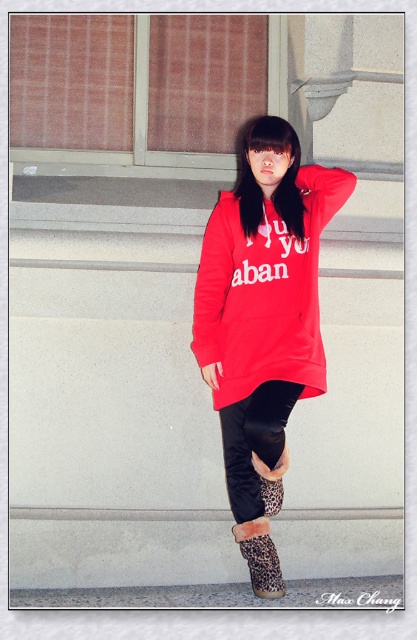
Who is positioned more to the left, matte red sweatshirt at center or leopard print fur boots at lower center?

Positioned to the left is leopard print fur boots at lower center.

Who is more distant from viewer, [278,205] or [241,540]?

The point [278,205] is behind.

I want to click on matte red sweatshirt at center, so click(x=263, y=323).